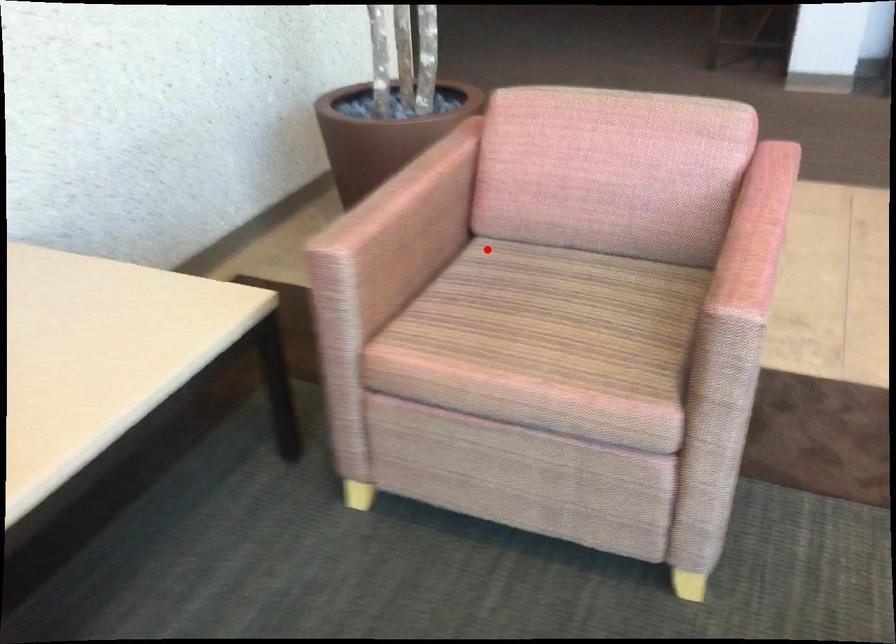
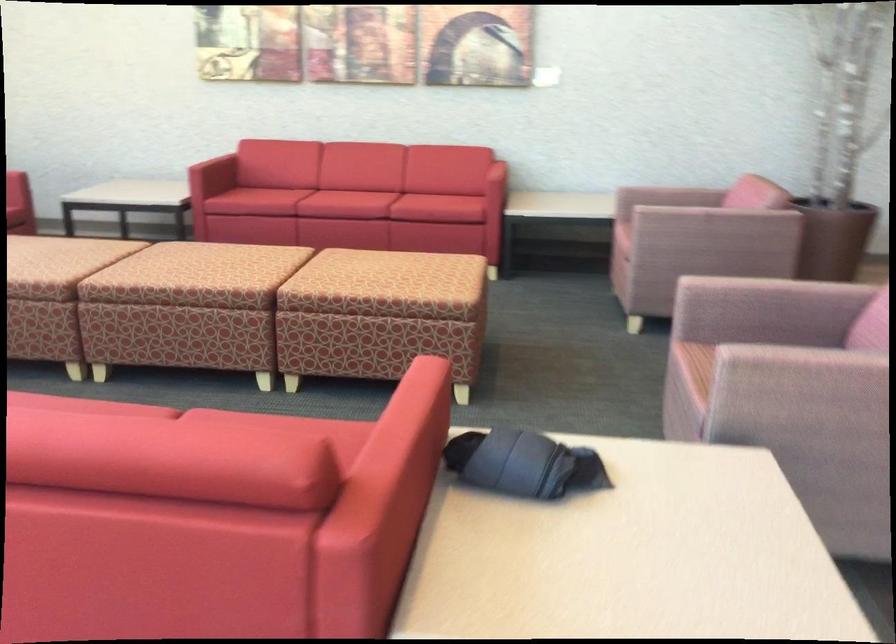
Find the pixel in the second image that matches the highlighted location in the first image.

(669, 196)